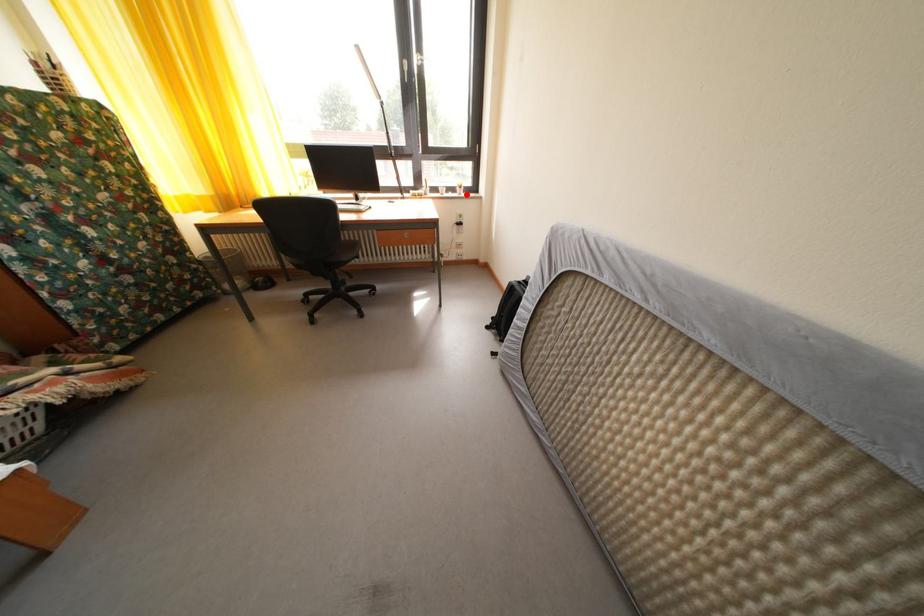
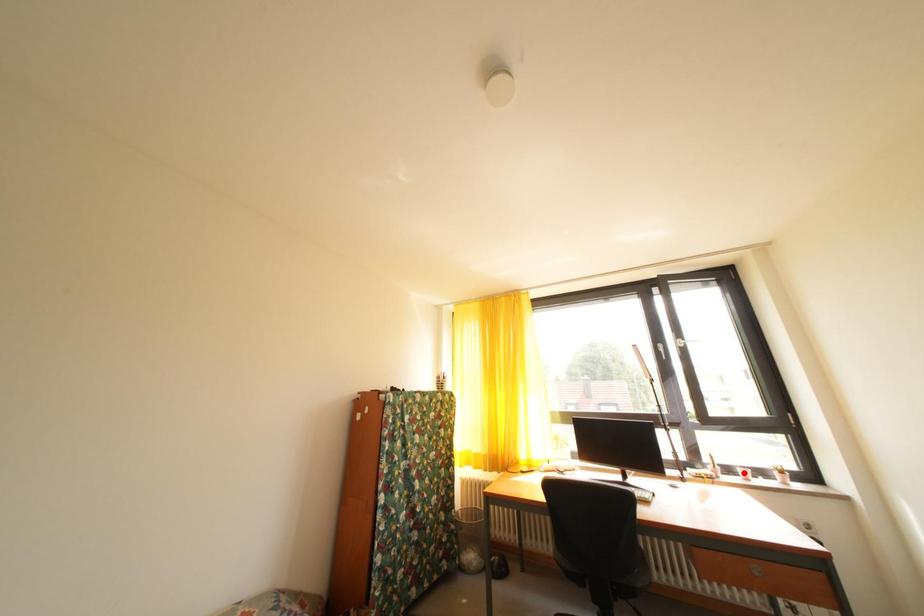
I am providing you with two images of the same scene from different viewpoints. A red point is marked on the first image and another point is marked on the second image. Does the point marked in image1 correspond to the same location as the one in image2?

No